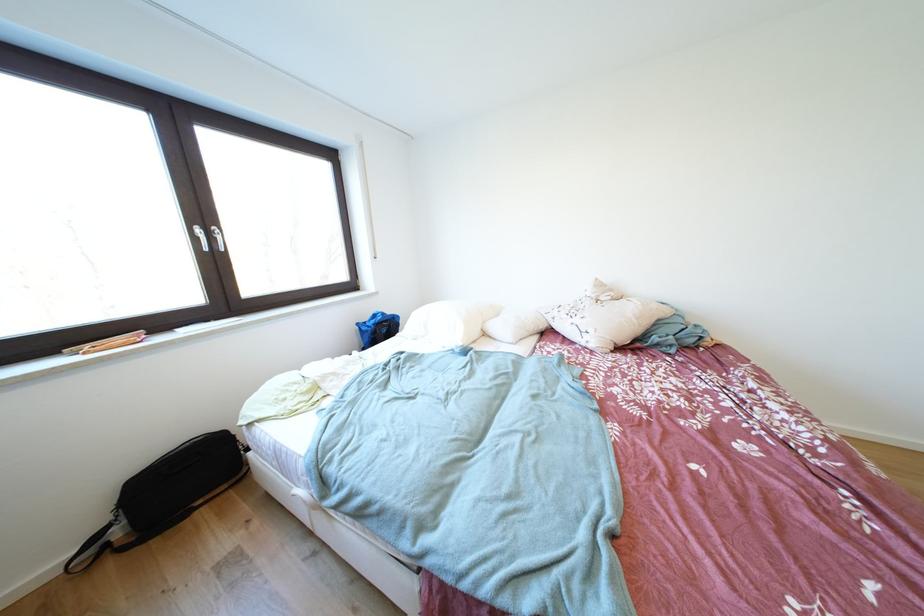
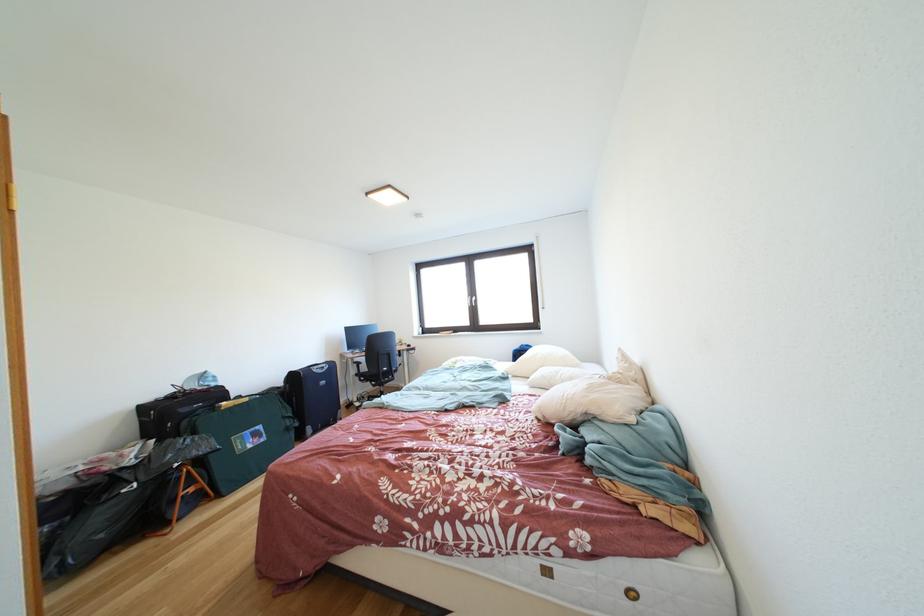
Locate, in the second image, the point that corresponds to [505,320] in the first image.

(570, 371)